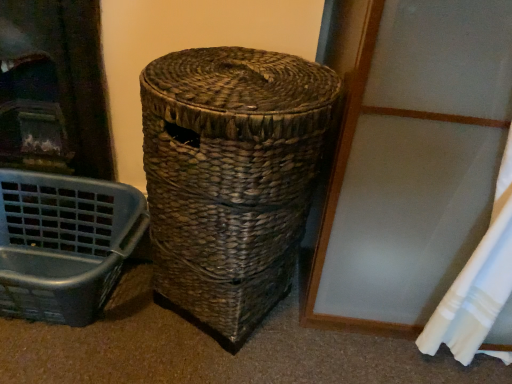
Question: In terms of width, does woven brown basket at center look wider or thinner when compared to white fabric curtain at lower right?

Choices:
 (A) wide
 (B) thin

Answer: (A)

Question: From the image's perspective, is woven brown basket at center positioned above or below white fabric curtain at lower right?

Choices:
 (A) below
 (B) above

Answer: (B)

Question: Estimate the real-world distances between objects in this image. Which object is farther from the white fabric curtain at lower right?

Choices:
 (A) woven brown basket at center
 (B) matte plastic laundry basket at lower left

Answer: (B)

Question: Which is nearer to the woven brown basket at center?

Choices:
 (A) matte plastic laundry basket at lower left
 (B) white fabric curtain at lower right

Answer: (A)